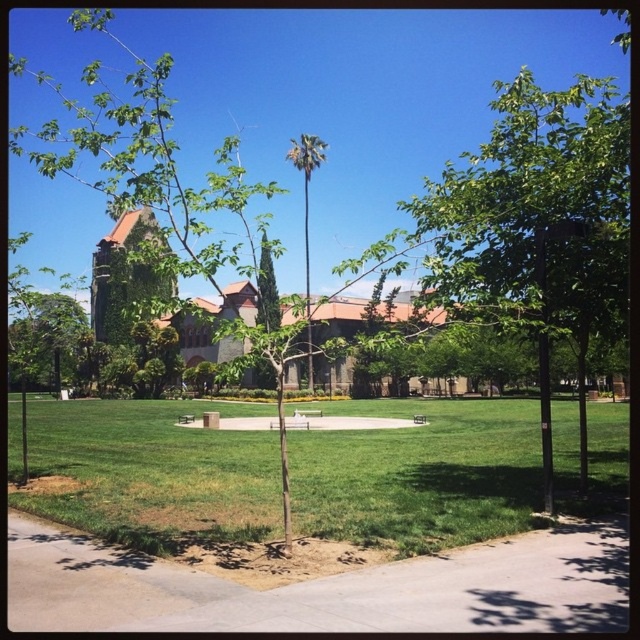
Between point (317, 412) and point (180, 413), which one is positioned behind?

Point (317, 412)

Does wooden park bench at center have a smaller size compared to brown wooden park bench at center?

No, wooden park bench at center is not smaller than brown wooden park bench at center.

Does point (320, 413) come in front of point (177, 417)?

No, (320, 413) is further to viewer.

You are a GUI agent. You are given a task and a screenshot of the screen. Output one action in this format:
    pyautogui.click(x=<x>, y=<y>)
    Task: Click on the wooden park bench at center
    
    Given the screenshot: What is the action you would take?
    pyautogui.click(x=307, y=412)

Which of these two, green leafy palm at center or green leafy tree at center, stands taller?

Standing taller between the two is green leafy palm at center.

Is point (310, 170) farther from camera compared to point (260, 372)?

Yes.

Find the location of a particular element. Image resolution: width=640 pixels, height=640 pixels. green leafy palm at center is located at coordinates (307, 214).

The image size is (640, 640). I want to click on green leafy palm at center, so click(307, 214).

Is the position of green leafy tree at center more distant than that of brown wooden bench at center?

No, green leafy tree at center is closer to the viewer.

Which is behind, point (266, 257) or point (284, 426)?

The point (266, 257) is more distant.

Where is `green leafy tree at center`? The image size is (640, 640). green leafy tree at center is located at coordinates (266, 291).